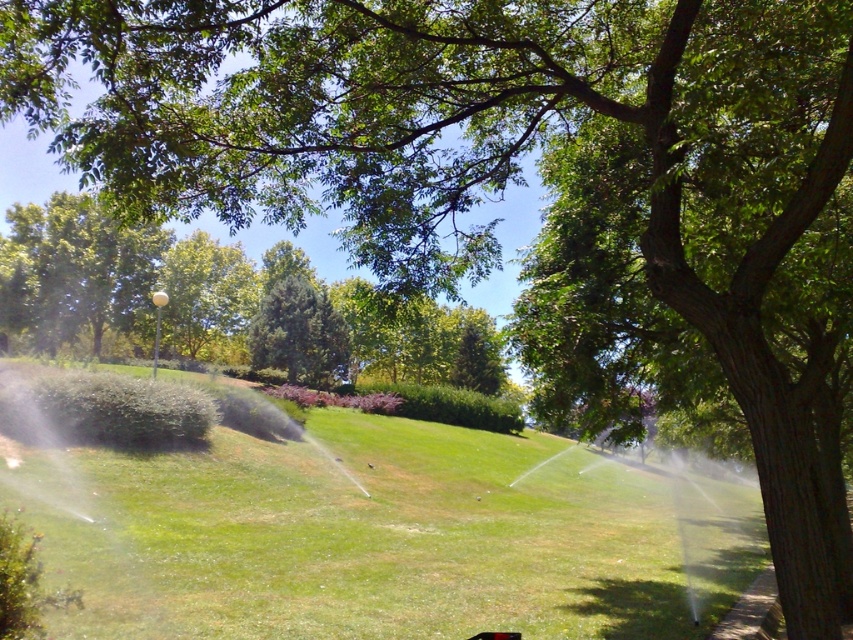
Question: Is green grass at center to the right of green textured evergreen tree at center from the viewer's perspective?

Choices:
 (A) yes
 (B) no

Answer: (A)

Question: Which of the following is the closest to the observer?

Choices:
 (A) (611, 595)
 (B) (331, 353)

Answer: (A)

Question: Can you confirm if green grass at center is positioned to the right of green textured evergreen tree at center?

Choices:
 (A) yes
 (B) no

Answer: (A)

Question: Can you confirm if green grass at center is positioned to the right of green textured evergreen tree at center?

Choices:
 (A) no
 (B) yes

Answer: (B)

Question: Which of the following is the closest to the observer?

Choices:
 (A) green grass at center
 (B) green textured evergreen tree at center

Answer: (A)